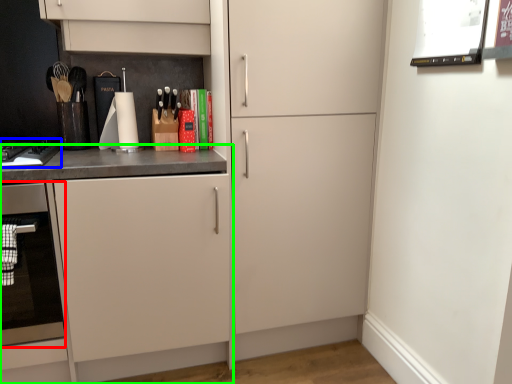
Question: Considering the real-world distances, which object is farthest from oven (highlighted by a red box)? home appliance (highlighted by a blue box) or cabinetry (highlighted by a green box)?

Choices:
 (A) home appliance
 (B) cabinetry

Answer: (A)